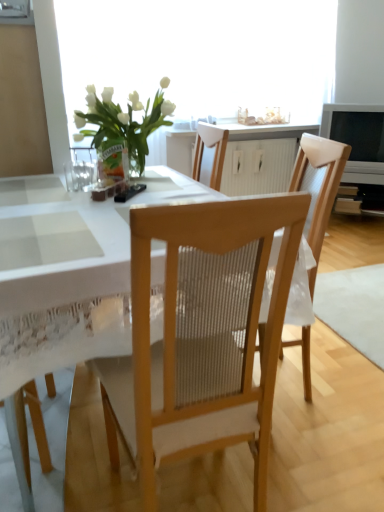
At what (x,y) coordinates should I click in order to perform the action: click on vacant space to the left of wooden chair at center, the 1th chair viewed from the front. Please return your answer as a coordinate pair (x, y). The image size is (384, 512). Looking at the image, I should click on (75, 464).